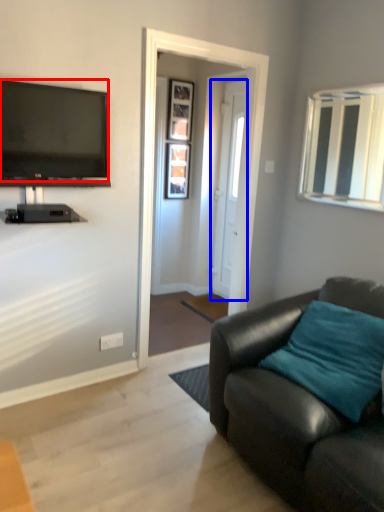
Question: Among these objects, which one is farthest to the camera, television (highlighted by a red box) or door (highlighted by a blue box)?

Choices:
 (A) television
 (B) door

Answer: (B)